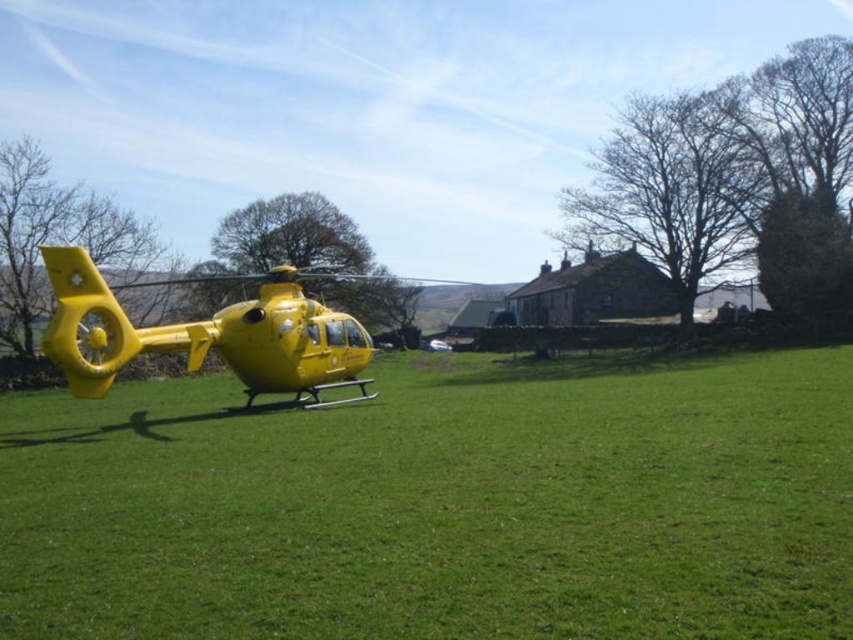
Does yellow matte helicopter at left have a greater height compared to yellow matte helicopter at center?

In fact, yellow matte helicopter at left may be shorter than yellow matte helicopter at center.

Measure the distance between point (473, 448) and camera.

Point (473, 448) is 11.04 meters from camera.

Where is `yellow matte helicopter at left`? The image size is (853, 640). yellow matte helicopter at left is located at coordinates (440, 506).